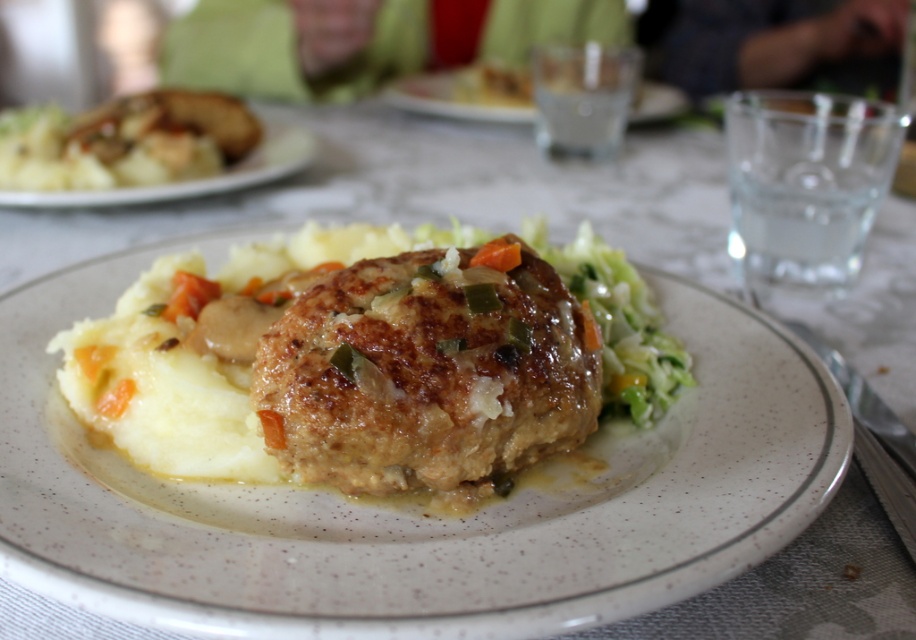
Question: In this image, where is golden-brown meatloaf at center located relative to matte brown mashed potatoes at upper left?

Choices:
 (A) below
 (B) above

Answer: (A)

Question: Which point is closer to the camera taking this photo?

Choices:
 (A) (548, 365)
 (B) (679, 554)

Answer: (B)

Question: Is golden-brown meatloaf at center wider than brown textured meatloaf at center?

Choices:
 (A) yes
 (B) no

Answer: (A)

Question: Among these objects, which one is farthest from the camera?

Choices:
 (A) brown textured meatloaf at center
 (B) matte brown mashed potatoes at upper left
 (C) golden-brown meatloaf at center

Answer: (B)

Question: Is golden-brown meatloaf at center above brown textured meatloaf at center?

Choices:
 (A) no
 (B) yes

Answer: (A)

Question: Which object is closer to the camera taking this photo?

Choices:
 (A) matte brown mashed potatoes at upper left
 (B) golden-brown meatloaf at center

Answer: (B)